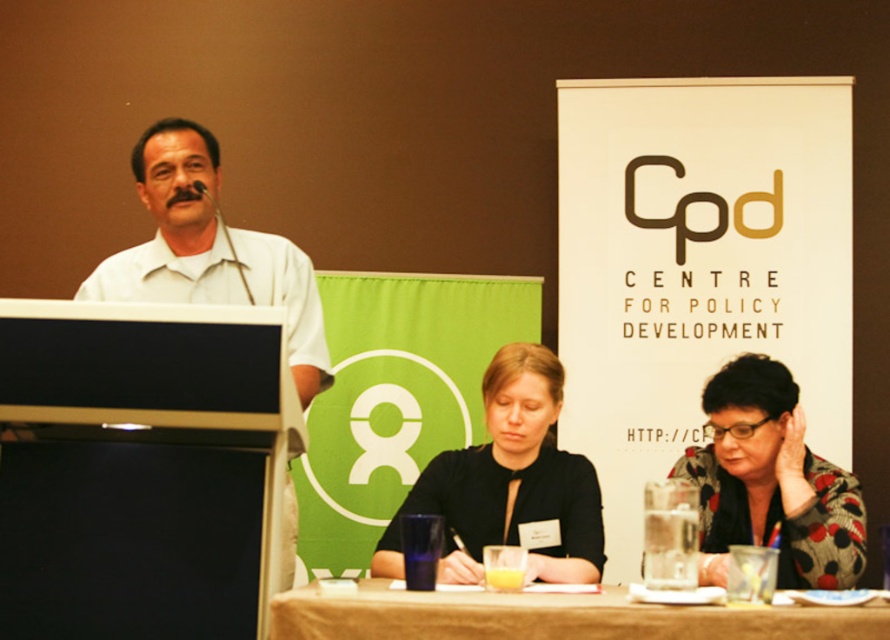
Who is shorter, matte black shirt at center or white matte shirt at left?

matte black shirt at center is shorter.

Does matte black shirt at center have a smaller size compared to white matte shirt at left?

Correct, matte black shirt at center occupies less space than white matte shirt at left.

Is point (537, 502) positioned behind point (171, 129)?

Yes, it is behind point (171, 129).

Where is `matte black shirt at center`? matte black shirt at center is located at coordinates (508, 483).

Does polka dot fabric jacket at lower right have a smaller size compared to white matte shirt at left?

Correct, polka dot fabric jacket at lower right occupies less space than white matte shirt at left.

What do you see at coordinates (770, 483) in the screenshot? The height and width of the screenshot is (640, 890). I see `polka dot fabric jacket at lower right` at bounding box center [770, 483].

I want to click on polka dot fabric jacket at lower right, so 770,483.

Measure the distance between white matte shirt at left and camera.

white matte shirt at left is 2.18 meters away from camera.

Between white matte shirt at left and brown wooden table at lower center, which one is positioned lower?

brown wooden table at lower center is lower down.

Who is more forward, (170, 163) or (449, 612)?

Point (449, 612)

Locate an element on the screen. white matte shirt at left is located at coordinates (209, 250).